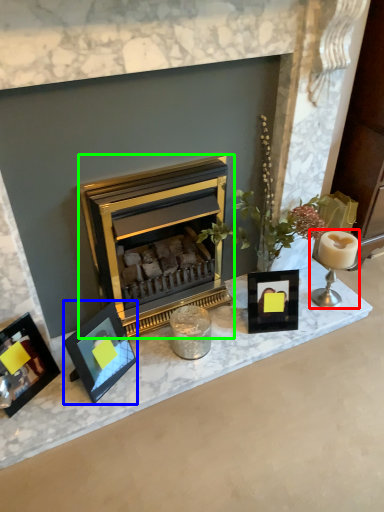
Question: Which object is positioned closest to candle holder (highlighted by a red box)? Select from picture frame (highlighted by a blue box) and wood burning stove (highlighted by a green box).

Choices:
 (A) picture frame
 (B) wood burning stove

Answer: (B)